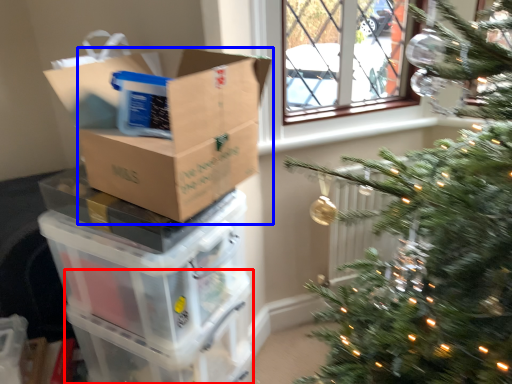
Question: Which of the following is the farthest to the observer, glass box (highlighted by a red box) or cardboard box (highlighted by a blue box)?

Choices:
 (A) glass box
 (B) cardboard box

Answer: (A)